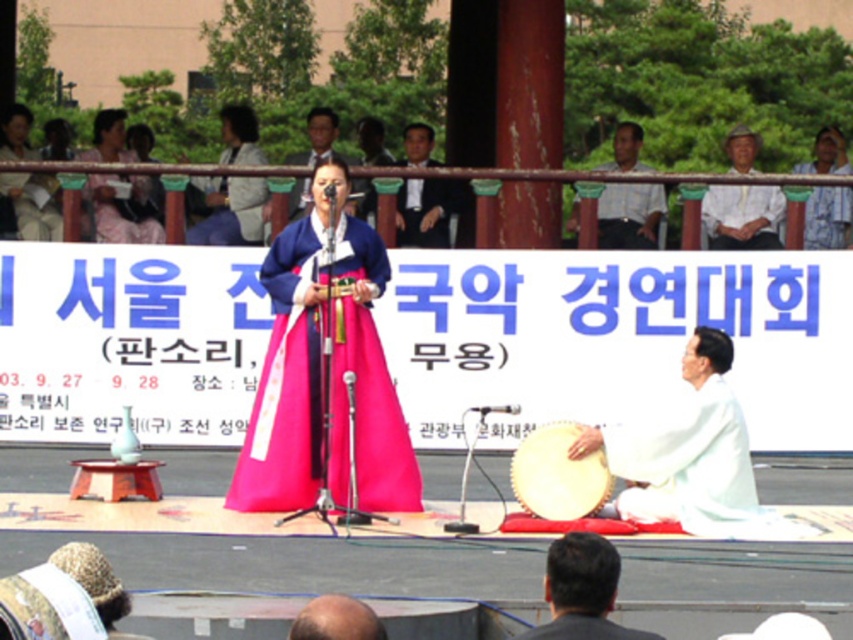
You are a photographer at the back of the stage and want to capture both the matte pink dress at center and the white striped shirt at upper center in a single shot. Which of the two items will appear smaller in the photo?

The matte pink dress at center will appear smaller in the photo because it is not as tall as the white striped shirt at upper center.

You are a photographer positioned at the camera. You want to capture a closeup shot of the matte pink dress at center. Based on its distance from the camera, can you confirm if it will be in focus without adjusting your current settings?

The matte pink dress at center is 21.94 meters from the camera. Since most cameras have a maximum focus distance, you may need to adjust your settings or move closer to ensure the dress is in focus.